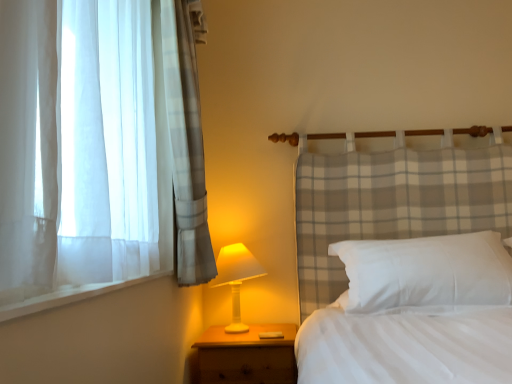
Question: Should I look upward or downward to see wooden nightstand at lower left?

Choices:
 (A) down
 (B) up

Answer: (A)

Question: From the image's perspective, does white soft pillow at center appear lower than wooden nightstand at lower left?

Choices:
 (A) yes
 (B) no

Answer: (B)

Question: Is white soft pillow at center taller than wooden nightstand at lower left?

Choices:
 (A) yes
 (B) no

Answer: (B)

Question: From the image's perspective, would you say white soft pillow at center is positioned over wooden nightstand at lower left?

Choices:
 (A) yes
 (B) no

Answer: (A)

Question: Is white soft pillow at center to the left of wooden nightstand at lower left from the viewer's perspective?

Choices:
 (A) yes
 (B) no

Answer: (B)

Question: From a real-world perspective, is white soft pillow at center over wooden nightstand at lower left?

Choices:
 (A) yes
 (B) no

Answer: (A)

Question: From a real-world perspective, does white soft pillow at center sit lower than wooden nightstand at lower left?

Choices:
 (A) yes
 (B) no

Answer: (B)

Question: Is wooden nightstand at lower left positioned in front of white plastic table lamp at lower center?

Choices:
 (A) yes
 (B) no

Answer: (A)

Question: Is wooden nightstand at lower left with white plastic table lamp at lower center?

Choices:
 (A) no
 (B) yes

Answer: (A)

Question: Is wooden nightstand at lower left bigger than white plastic table lamp at lower center?

Choices:
 (A) no
 (B) yes

Answer: (B)

Question: From a real-world perspective, is wooden nightstand at lower left located beneath white plastic table lamp at lower center?

Choices:
 (A) no
 (B) yes

Answer: (B)

Question: Is the position of wooden nightstand at lower left more distant than that of white plastic table lamp at lower center?

Choices:
 (A) no
 (B) yes

Answer: (A)

Question: Is wooden nightstand at lower left far away from white plastic table lamp at lower center?

Choices:
 (A) no
 (B) yes

Answer: (A)

Question: Is white plastic table lamp at lower center thinner than white soft pillow at center?

Choices:
 (A) no
 (B) yes

Answer: (B)